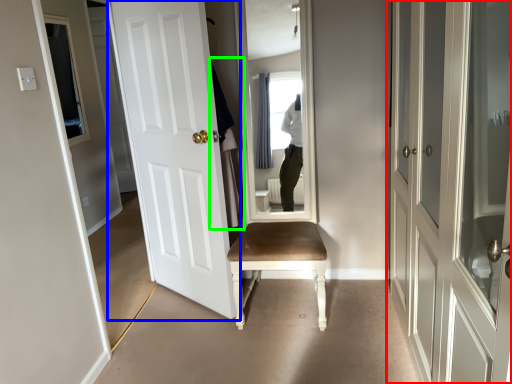
Question: Which object is positioned farthest from door (highlighted by a red box)? Select from door (highlighted by a blue box) and robe (highlighted by a green box).

Choices:
 (A) door
 (B) robe

Answer: (A)